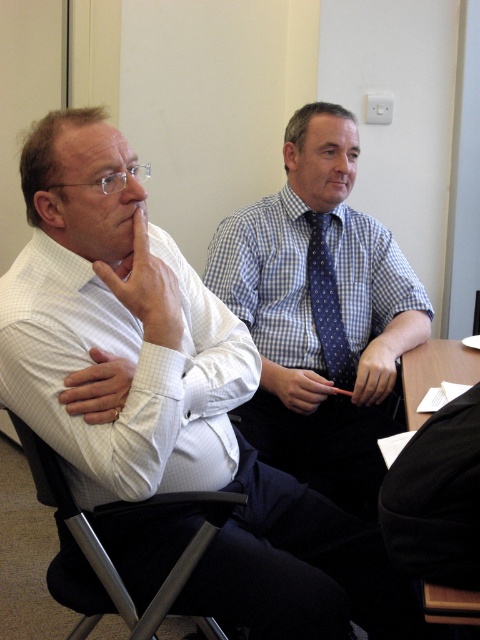
Question: Which of the following is the closest to the observer?

Choices:
 (A) black fabric at lower right
 (B) white checkered shirt at left
 (C) metallic gray chair at lower left

Answer: (A)

Question: Which object is closer to the camera taking this photo?

Choices:
 (A) blue dotted fabric tie at center
 (B) metallic gray chair at lower left
 (C) blue checkered shirt at center
 (D) black fabric at lower right

Answer: (D)

Question: Where is white checkered shirt at left located in relation to metallic gray chair at lower left in the image?

Choices:
 (A) above
 (B) below

Answer: (A)

Question: Which of these objects is positioned closest to the metallic gray chair at lower left?

Choices:
 (A) white checkered shirt at left
 (B) black fabric at lower right

Answer: (A)

Question: From the image, what is the correct spatial relationship of blue checkered shirt at center in relation to black fabric at lower right?

Choices:
 (A) left
 (B) right

Answer: (A)

Question: Observing the image, what is the correct spatial positioning of blue checkered shirt at center in reference to blue dotted fabric tie at center?

Choices:
 (A) right
 (B) left

Answer: (B)